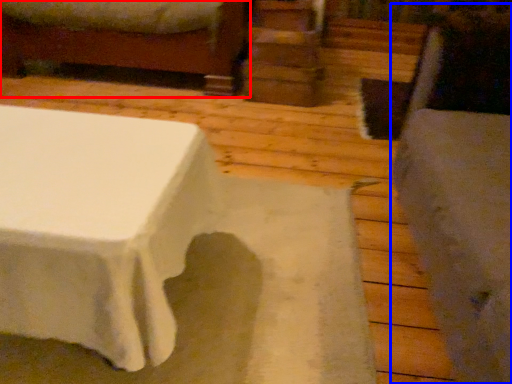
Question: Among these objects, which one is nearest to the camera, furniture (highlighted by a red box) or swivel chair (highlighted by a blue box)?

Choices:
 (A) furniture
 (B) swivel chair

Answer: (B)